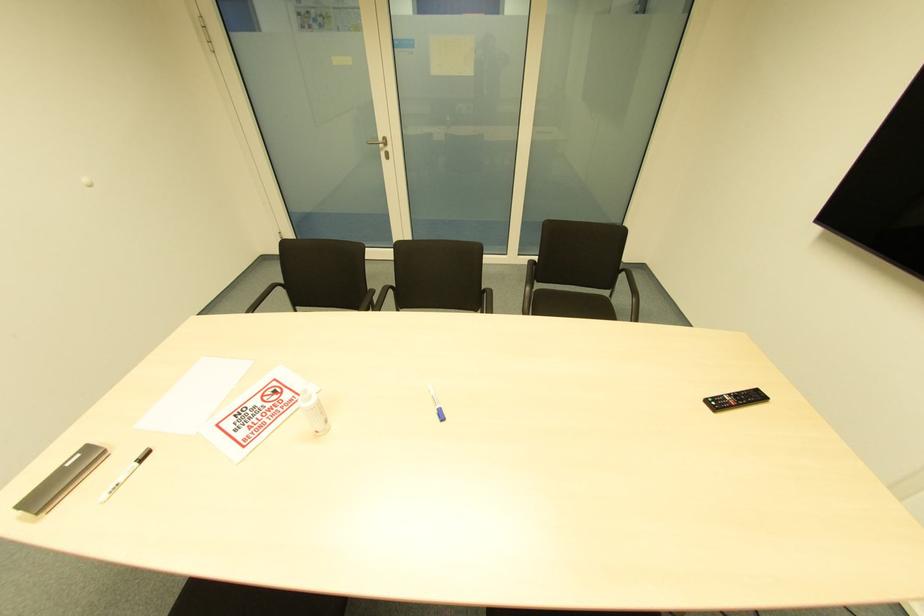
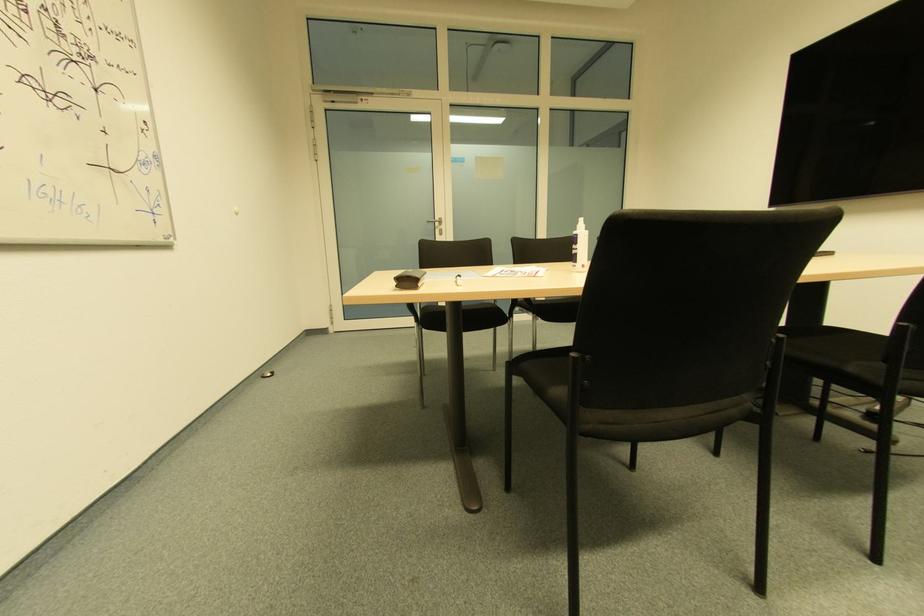
Find the pixel in the second image that matches point 386,152 in the first image.

(440, 230)